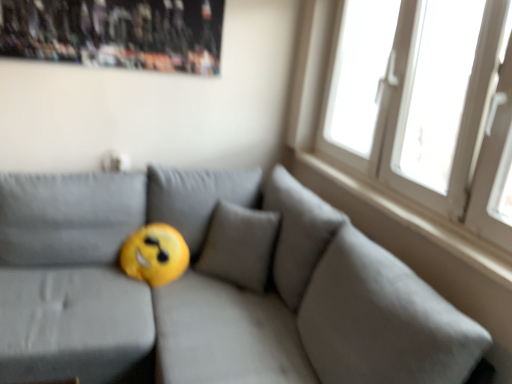
Question: Visually, is white smooth window sill at upper right positioned to the left or to the right of yellow fabric pillow at center?

Choices:
 (A) right
 (B) left

Answer: (A)

Question: In terms of width, does white smooth window sill at upper right look wider or thinner when compared to yellow fabric pillow at center?

Choices:
 (A) thin
 (B) wide

Answer: (A)

Question: Which object is the farthest from the white plastic window at upper right?

Choices:
 (A) yellow fabric pillow at center
 (B) white smooth window sill at upper right
 (C) wooden poster at upper left

Answer: (C)

Question: Which of these objects is positioned farthest from the white plastic window at upper right?

Choices:
 (A) white smooth window sill at upper right
 (B) yellow fabric pillow at center
 (C) wooden poster at upper left

Answer: (C)